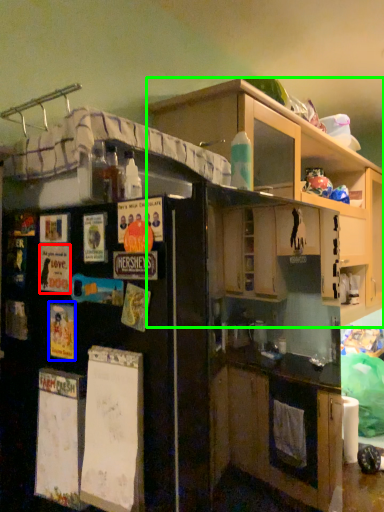
Question: Which object is the farthest from poster (highlighted by a red box)? Choose among these: poster (highlighted by a blue box) or cabinetry (highlighted by a green box).

Choices:
 (A) poster
 (B) cabinetry

Answer: (B)